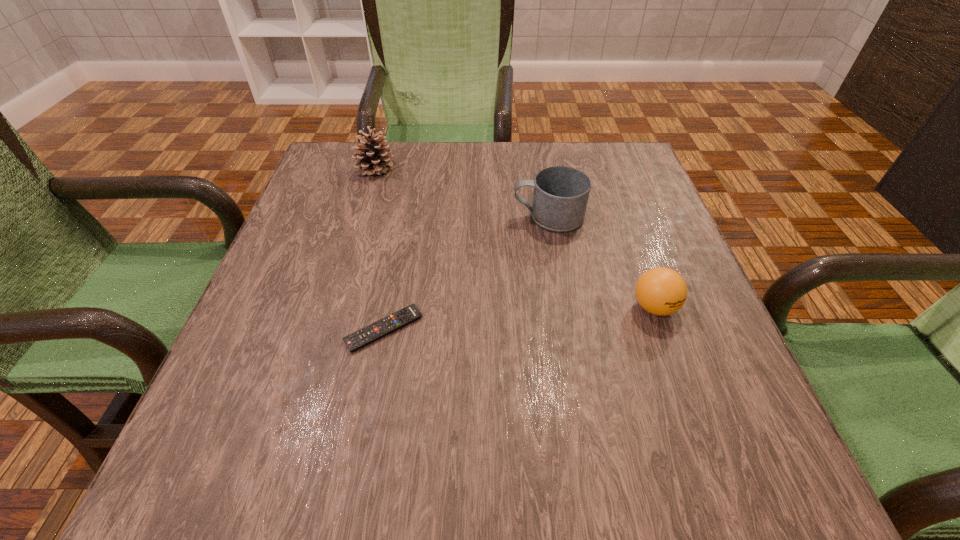
The width and height of the screenshot is (960, 540). I want to click on free space between the remote control and the farthest object, so click(379, 249).

Point out which object is positioned as the nearest to the ping-pong ball. Please provide its 2D coordinates. Your answer should be formatted as a tuple, i.e. [(x, y)], where the tuple contains the x and y coordinates of a point satisfying the conditions above.

[(560, 198)]

Point out which object is positioned as the third nearest to the remote control. Please provide its 2D coordinates. Your answer should be formatted as a tuple, i.e. [(x, y)], where the tuple contains the x and y coordinates of a point satisfying the conditions above.

[(375, 159)]

Locate an element on the screen. Image resolution: width=960 pixels, height=540 pixels. free space in the image that satisfies the following two spatial constraints: 1. on the side of the mug with the handle; 2. on the front side of the shortest object is located at coordinates (568, 329).